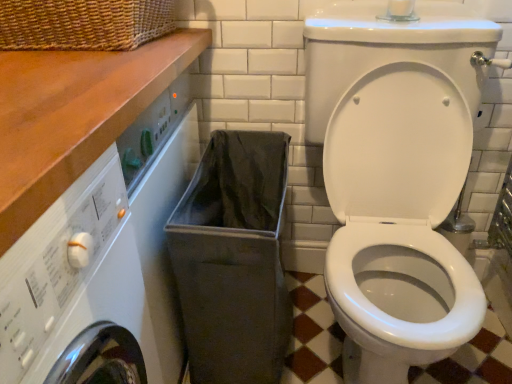
Question: Should I look upward or downward to see wooden at upper left?

Choices:
 (A) down
 (B) up

Answer: (B)

Question: Does wooden at upper left have a lesser height compared to white glossy toilet at center?

Choices:
 (A) no
 (B) yes

Answer: (B)

Question: Is wooden at upper left in front of white glossy toilet at center?

Choices:
 (A) yes
 (B) no

Answer: (A)

Question: Considering the relative sizes of wooden at upper left and white glossy toilet at center in the image provided, is wooden at upper left smaller than white glossy toilet at center?

Choices:
 (A) yes
 (B) no

Answer: (A)

Question: From the image's perspective, is wooden at upper left on top of white glossy toilet at center?

Choices:
 (A) yes
 (B) no

Answer: (A)

Question: From a real-world perspective, is wooden at upper left over white glossy toilet at center?

Choices:
 (A) no
 (B) yes

Answer: (B)

Question: Is wooden at upper left oriented towards white glossy toilet at center?

Choices:
 (A) no
 (B) yes

Answer: (B)

Question: Is white glossy toilet at center positioned with its back to gray fabric laundry basket at lower center?

Choices:
 (A) no
 (B) yes

Answer: (A)

Question: Is white glossy toilet at center further to the viewer compared to gray fabric laundry basket at lower center?

Choices:
 (A) yes
 (B) no

Answer: (B)

Question: From a real-world perspective, is white glossy toilet at center below gray fabric laundry basket at lower center?

Choices:
 (A) yes
 (B) no

Answer: (B)

Question: From the image's perspective, is white glossy toilet at center under gray fabric laundry basket at lower center?

Choices:
 (A) yes
 (B) no

Answer: (B)

Question: Does white glossy toilet at center have a larger size compared to gray fabric laundry basket at lower center?

Choices:
 (A) yes
 (B) no

Answer: (A)

Question: Is white glossy toilet at center located outside gray fabric laundry basket at lower center?

Choices:
 (A) no
 (B) yes

Answer: (B)

Question: From a real-world perspective, is gray fabric laundry basket at lower center under wooden at upper left?

Choices:
 (A) yes
 (B) no

Answer: (A)